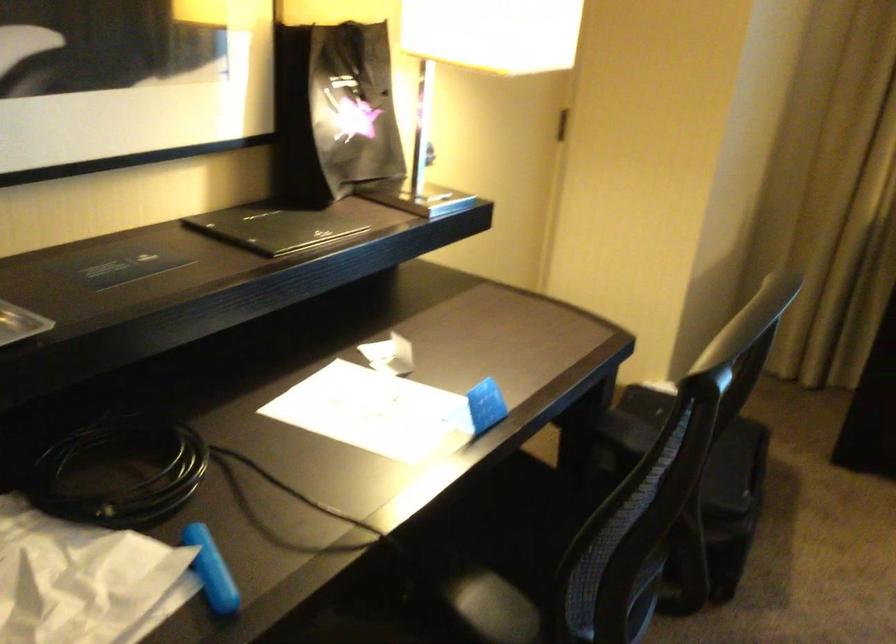
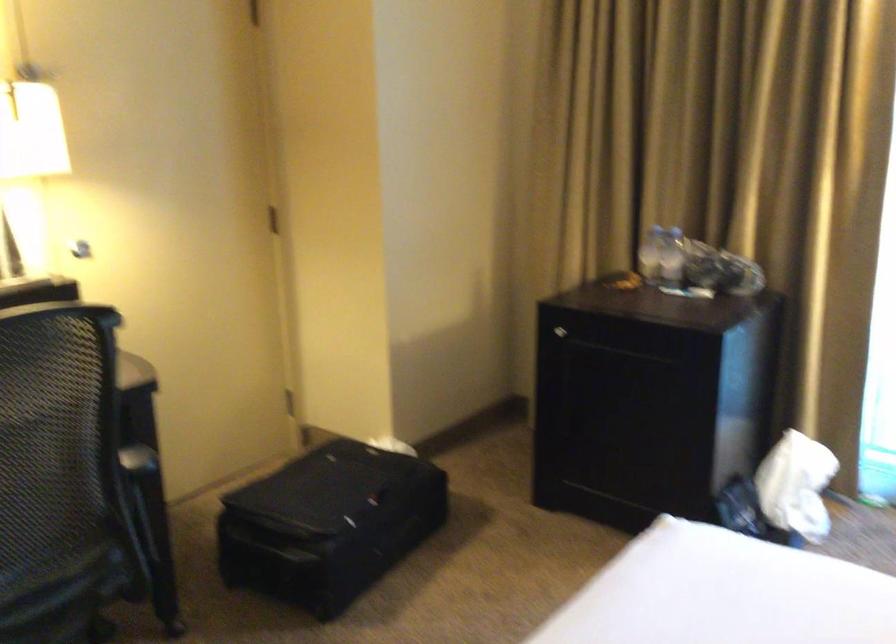
The point at (x=727, y=494) is marked in the first image. Where is the corresponding point in the second image?

(328, 524)